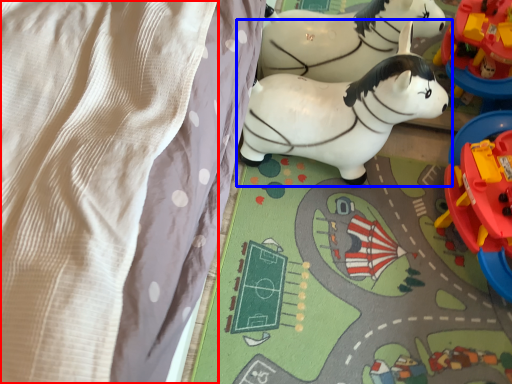
Question: Which of the following is the closest to the observer, blanket (highlighted by a red box) or toy (highlighted by a blue box)?

Choices:
 (A) blanket
 (B) toy

Answer: (A)